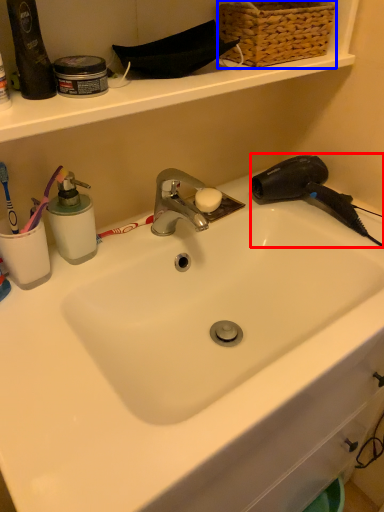
Question: Which of the following is the closest to the observer, hair drier (highlighted by a red box) or basket (highlighted by a blue box)?

Choices:
 (A) hair drier
 (B) basket

Answer: (B)